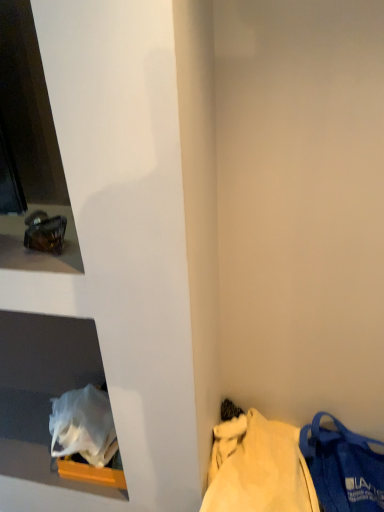
At what (x,y) coordinates should I click in order to perform the action: click on blue fabric tote bag at lower right. Please return your answer as a coordinate pair (x, y). The height and width of the screenshot is (512, 384). Looking at the image, I should click on (258, 468).

Could you tell me if matte glass ashtray at upper left is turned towards matte blue fabric bag at lower right?

No.

Does matte glass ashtray at upper left touch matte blue fabric bag at lower right?

There is a gap between matte glass ashtray at upper left and matte blue fabric bag at lower right.

From the image's perspective, which one is positioned higher, matte glass ashtray at upper left or matte blue fabric bag at lower right?

matte glass ashtray at upper left is shown above in the image.

Can you confirm if matte glass ashtray at upper left is thinner than matte blue fabric bag at lower right?

Yes.

Considering the relative sizes of blue fabric tote bag at lower right and matte glass ashtray at upper left in the image provided, is blue fabric tote bag at lower right taller than matte glass ashtray at upper left?

Correct, blue fabric tote bag at lower right is much taller as matte glass ashtray at upper left.

Could you tell me if blue fabric tote bag at lower right is facing matte glass ashtray at upper left?

No, blue fabric tote bag at lower right is not facing towards matte glass ashtray at upper left.

Measure the distance from blue fabric tote bag at lower right to matte glass ashtray at upper left.

blue fabric tote bag at lower right and matte glass ashtray at upper left are 70.86 centimeters apart from each other.

From the image's perspective, is blue fabric tote bag at lower right above matte glass ashtray at upper left?

No, from the image's perspective, blue fabric tote bag at lower right is not over matte glass ashtray at upper left.

Considering the relative sizes of matte blue fabric bag at lower right and blue fabric tote bag at lower right in the image provided, is matte blue fabric bag at lower right smaller than blue fabric tote bag at lower right?

Yes, matte blue fabric bag at lower right is smaller than blue fabric tote bag at lower right.

Considering the positions of objects matte blue fabric bag at lower right and blue fabric tote bag at lower right in the image provided, who is more to the left, matte blue fabric bag at lower right or blue fabric tote bag at lower right?

From the viewer's perspective, blue fabric tote bag at lower right appears more on the left side.

Where is `handbag behind the blue fabric tote bag at lower right`? handbag behind the blue fabric tote bag at lower right is located at coordinates (343, 467).

Considering the positions of points (68, 211) and (89, 367), is point (68, 211) farther from camera compared to point (89, 367)?

No, it is not.

Is matte glass ashtray at upper left wider or thinner than white plastic bag at lower left?

matte glass ashtray at upper left is thinner than white plastic bag at lower left.

From the image's perspective, who appears lower, matte glass ashtray at upper left or white plastic bag at lower left?

white plastic bag at lower left, from the image's perspective.

Considering the sizes of matte glass ashtray at upper left and white plastic bag at lower left in the image, is matte glass ashtray at upper left taller or shorter than white plastic bag at lower left?

matte glass ashtray at upper left is taller than white plastic bag at lower left.

Considering the positions of objects white plastic bag at lower left and matte glass ashtray at upper left in the image provided, who is more to the right, white plastic bag at lower left or matte glass ashtray at upper left?

matte glass ashtray at upper left is more to the right.

From a real-world perspective, relative to matte glass ashtray at upper left, is white plastic bag at lower left vertically above or below?

white plastic bag at lower left is situated lower than matte glass ashtray at upper left in the real world.

Looking at the image, does white plastic bag at lower left seem bigger or smaller compared to matte glass ashtray at upper left?

In the image, white plastic bag at lower left appears to be larger than matte glass ashtray at upper left.

Between white plastic bag at lower left and matte glass ashtray at upper left, which one is positioned behind?

Positioned behind is white plastic bag at lower left.

Which is behind, point (318, 477) or point (48, 329)?

Positioned behind is point (48, 329).

Based on the photo, could you tell me if matte blue fabric bag at lower right is turned towards white plastic bag at lower left?

No, matte blue fabric bag at lower right does not turn towards white plastic bag at lower left.

Which of these two, matte blue fabric bag at lower right or white plastic bag at lower left, is wider?

Answer: white plastic bag at lower left.

Looking at this image, does matte blue fabric bag at lower right come in front of white plastic bag at lower left?

Yes, it is in front of white plastic bag at lower left.

Can you confirm if blue fabric tote bag at lower right is thinner than white plastic bag at lower left?

Incorrect, the width of blue fabric tote bag at lower right is not less than that of white plastic bag at lower left.

Is blue fabric tote bag at lower right further to camera compared to white plastic bag at lower left?

No.

Are blue fabric tote bag at lower right and white plastic bag at lower left far apart?

No.

The width and height of the screenshot is (384, 512). I want to click on window sill positioned vertically above the matte blue fabric bag at lower right (from a real-world perspective), so click(37, 251).

Identify the location of tote bag behind the matte glass ashtray at upper left. This screenshot has height=512, width=384. (258, 468).

Which object lies further to the anchor point matte glass ashtray at upper left, white plastic bag at lower left or blue fabric tote bag at lower right?

Based on the image, blue fabric tote bag at lower right appears to be further to matte glass ashtray at upper left.

In the scene shown: Considering their positions, is white plastic bag at lower left positioned closer to matte glass ashtray at upper left than matte blue fabric bag at lower right?

The object closer to matte glass ashtray at upper left is white plastic bag at lower left.

Based on their spatial positions, is matte glass ashtray at upper left or matte blue fabric bag at lower right further from white plastic bag at lower left?

The object further to white plastic bag at lower left is matte blue fabric bag at lower right.

From the image, which object appears to be nearer to blue fabric tote bag at lower right, white plastic bag at lower left or matte blue fabric bag at lower right?

Based on the image, matte blue fabric bag at lower right appears to be nearer to blue fabric tote bag at lower right.

Which object lies further to the anchor point matte blue fabric bag at lower right, matte glass ashtray at upper left or white plastic bag at lower left?

matte glass ashtray at upper left is positioned further to the anchor matte blue fabric bag at lower right.

Based on the photo, based on their spatial positions, is matte blue fabric bag at lower right or matte glass ashtray at upper left further from blue fabric tote bag at lower right?

The object further to blue fabric tote bag at lower right is matte glass ashtray at upper left.

Considering their positions, is blue fabric tote bag at lower right positioned closer to matte blue fabric bag at lower right than white plastic bag at lower left?

blue fabric tote bag at lower right lies closer to matte blue fabric bag at lower right than the other object.

Considering their positions, is matte blue fabric bag at lower right positioned further to blue fabric tote bag at lower right than white plastic bag at lower left?

white plastic bag at lower left is positioned further to the anchor blue fabric tote bag at lower right.

This screenshot has width=384, height=512. I want to click on tote bag between white plastic bag at lower left and matte blue fabric bag at lower right, so click(258, 468).

In order to click on window sill between white plastic bag at lower left and matte blue fabric bag at lower right from left to right in this screenshot , I will do `click(37, 251)`.

At what (x,y) coordinates should I click in order to perform the action: click on tote bag that lies between matte glass ashtray at upper left and matte blue fabric bag at lower right from top to bottom. Please return your answer as a coordinate pair (x, y). The image size is (384, 512). Looking at the image, I should click on (258, 468).

What are the coordinates of `cabinet between matte glass ashtray at upper left and blue fabric tote bag at lower right vertically` in the screenshot? It's located at (42, 390).